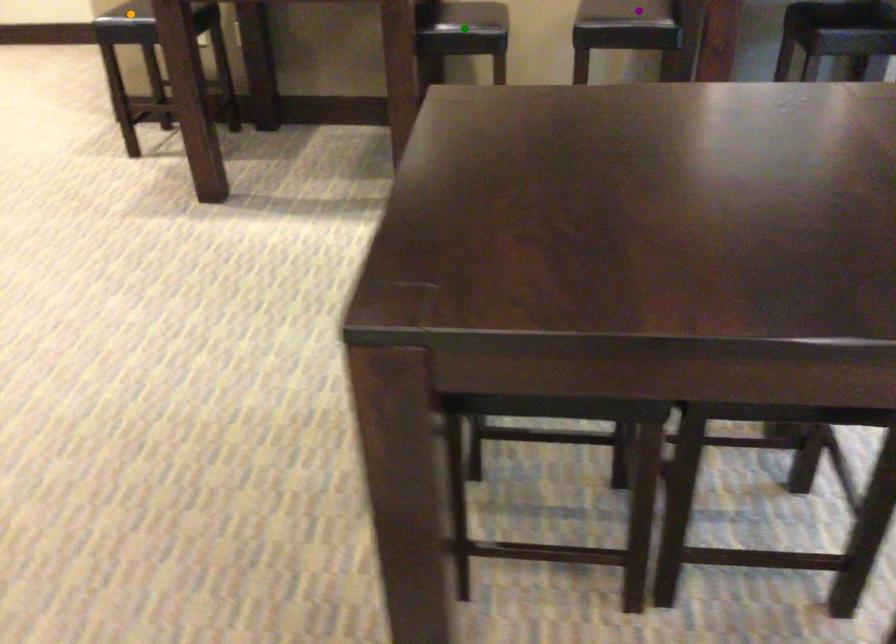
Order these from nearest to farthest:
orange point, purple point, green point

green point, purple point, orange point